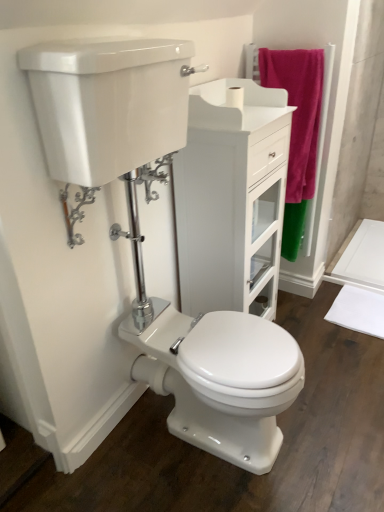
Describe the element at coordinates (297, 130) in the screenshot. I see `pink fuzzy towel at upper right` at that location.

Image resolution: width=384 pixels, height=512 pixels. What do you see at coordinates (232, 198) in the screenshot? I see `white glossy cabinet at center` at bounding box center [232, 198].

What do you see at coordinates (76, 211) in the screenshot? The height and width of the screenshot is (512, 384). I see `chrome metallic lever at upper left, acting as the first plumbing fixture starting from the bottom` at bounding box center [76, 211].

At what (x,y) coordinates should I click in order to perform the action: click on chrome metallic lever at upper left, the second plumbing fixture when ordered from top to bottom. Please return your answer as a coordinate pair (x, y). This screenshot has width=384, height=512. Looking at the image, I should click on (76, 211).

I want to click on polished chrome flush handle at center, which appears as the 2th plumbing fixture when viewed from the left, so click(154, 176).

Does pink fuzzy towel at upper right have a greater height compared to white matte toilet paper at upper center?

Yes.

From the image's perspective, is pink fuzzy towel at upper right over white matte toilet paper at upper center?

No, from the image's perspective, pink fuzzy towel at upper right is not above white matte toilet paper at upper center.

Considering the points (312, 146) and (234, 98), which point is in front, point (312, 146) or point (234, 98)?

Positioned in front is point (234, 98).

How different are the orientations of pink fuzzy towel at upper right and white matte toilet paper at upper center in degrees?

pink fuzzy towel at upper right and white matte toilet paper at upper center are facing 90.5 degrees away from each other.

Does pink fuzzy towel at upper right have a lesser height compared to white glossy cabinet at center?

Correct, pink fuzzy towel at upper right is not as tall as white glossy cabinet at center.

Is white glossy cabinet at center at the back of pink fuzzy towel at upper right?

That's right, pink fuzzy towel at upper right is facing away from white glossy cabinet at center.

Who is smaller, pink fuzzy towel at upper right or white glossy cabinet at center?

pink fuzzy towel at upper right.

Is chrome metallic lever at upper left, the second plumbing fixture from the right, not close to white glossy cabinet at center?

That's not correct — chrome metallic lever at upper left, the second plumbing fixture from the right, is a little close to white glossy cabinet at center.

Does chrome metallic lever at upper left, the second plumbing fixture from the right, have a larger size compared to white glossy cabinet at center?

Actually, chrome metallic lever at upper left, the second plumbing fixture from the right, might be smaller than white glossy cabinet at center.

Which object is wider, chrome metallic lever at upper left, the second plumbing fixture from the right, or white glossy cabinet at center?

white glossy cabinet at center.

From the image's perspective, which one is positioned higher, chrome metallic lever at upper left, acting as the first plumbing fixture starting from the bottom, or white glossy cabinet at center?

From the image's view, white glossy cabinet at center is above.

Could you measure the distance between white matte toilet paper at upper center and polished chrome flush handle at center, marked as the 1th plumbing fixture in a back-to-front arrangement?

white matte toilet paper at upper center is 18.10 inches from polished chrome flush handle at center, marked as the 1th plumbing fixture in a back-to-front arrangement.

Locate an element on the screen. toilet paper above the polished chrome flush handle at center, which is the second plumbing fixture from bottom to top (from the image's perspective) is located at coordinates (235, 97).

Is there a large distance between white matte toilet paper at upper center and polished chrome flush handle at center, marked as the 1th plumbing fixture in a back-to-front arrangement?

No, white matte toilet paper at upper center is not far away from polished chrome flush handle at center, marked as the 1th plumbing fixture in a back-to-front arrangement.

Which of these two, polished chrome flush handle at center, placed as the first plumbing fixture when sorted from right to left, or pink fuzzy towel at upper right, is thinner?

pink fuzzy towel at upper right.

From the image's perspective, which one is positioned lower, polished chrome flush handle at center, marked as the 1th plumbing fixture in a back-to-front arrangement, or pink fuzzy towel at upper right?

From the image's view, polished chrome flush handle at center, marked as the 1th plumbing fixture in a back-to-front arrangement, is below.

Based on the photo, considering the relative positions of polished chrome flush handle at center, which appears as the 2th plumbing fixture when viewed from the left, and pink fuzzy towel at upper right in the image provided, is polished chrome flush handle at center, which appears as the 2th plumbing fixture when viewed from the left, behind pink fuzzy towel at upper right?

No, polished chrome flush handle at center, which appears as the 2th plumbing fixture when viewed from the left, is in front of pink fuzzy towel at upper right.

Is white matte toilet paper at upper center oriented away from pink fuzzy towel at upper right?

white matte toilet paper at upper center does not have its back to pink fuzzy towel at upper right.

Considering the relative positions of white matte toilet paper at upper center and pink fuzzy towel at upper right in the image provided, is white matte toilet paper at upper center in front of pink fuzzy towel at upper right?

Yes, white matte toilet paper at upper center is in front of pink fuzzy towel at upper right.

From the image's perspective, which one is positioned higher, white matte toilet paper at upper center or pink fuzzy towel at upper right?

white matte toilet paper at upper center is shown above in the image.

From a real-world perspective, who is located higher, white matte toilet paper at upper center or pink fuzzy towel at upper right?

white matte toilet paper at upper center.

Between point (296, 217) and point (66, 191), which one is positioned behind?

The point (296, 217) is behind.

Does pink fuzzy towel at upper right have a larger size compared to chrome metallic lever at upper left, the second plumbing fixture when ordered from top to bottom?

Indeed, pink fuzzy towel at upper right has a larger size compared to chrome metallic lever at upper left, the second plumbing fixture when ordered from top to bottom.

From the image's perspective, which object appears higher, pink fuzzy towel at upper right or chrome metallic lever at upper left, which is counted as the 2th plumbing fixture, starting from the back?

pink fuzzy towel at upper right.

Between pink fuzzy towel at upper right and chrome metallic lever at upper left, acting as the first plumbing fixture starting from the bottom, which one appears on the right side from the viewer's perspective?

Positioned to the right is pink fuzzy towel at upper right.

Where is `toilet paper to the left of pink fuzzy towel at upper right`? The image size is (384, 512). toilet paper to the left of pink fuzzy towel at upper right is located at coordinates (x=235, y=97).

Find the location of `bath towel lying on the right of white glossy cabinet at center`. bath towel lying on the right of white glossy cabinet at center is located at coordinates (297, 130).

From the image, which object appears to be farther from pink fuzzy towel at upper right, chrome metallic lever at upper left, the 1th plumbing fixture viewed from the left, or white matte toilet paper at upper center?

chrome metallic lever at upper left, the 1th plumbing fixture viewed from the left, is positioned further to the anchor pink fuzzy towel at upper right.

From the image, which object appears to be farther from chrome metallic lever at upper left, which is counted as the 2th plumbing fixture, starting from the back, polished chrome flush handle at center, marked as the first plumbing fixture in a top-to-bottom arrangement, or white glossy cabinet at center?

Based on the image, white glossy cabinet at center appears to be further to chrome metallic lever at upper left, which is counted as the 2th plumbing fixture, starting from the back.

Looking at the image, which one is located further to white glossy cabinet at center, white matte toilet paper at upper center or chrome metallic lever at upper left, which is counted as the 2th plumbing fixture, starting from the back?

Based on the image, chrome metallic lever at upper left, which is counted as the 2th plumbing fixture, starting from the back, appears to be further to white glossy cabinet at center.

From the image, which object appears to be farther from white glossy cabinet at center, polished chrome flush handle at center, which is the second plumbing fixture in front-to-back order, or chrome metallic lever at upper left, the second plumbing fixture when ordered from top to bottom?

chrome metallic lever at upper left, the second plumbing fixture when ordered from top to bottom.

When comparing their distances from white glossy cabinet at center, does white matte toilet paper at upper center or polished chrome flush handle at center, marked as the first plumbing fixture in a top-to-bottom arrangement, seem closer?

polished chrome flush handle at center, marked as the first plumbing fixture in a top-to-bottom arrangement, lies closer to white glossy cabinet at center than the other object.

From the image, which object appears to be farther from white matte toilet paper at upper center, chrome metallic lever at upper left, the first plumbing fixture in the front-to-back sequence, or polished chrome flush handle at center, placed as the first plumbing fixture when sorted from right to left?

chrome metallic lever at upper left, the first plumbing fixture in the front-to-back sequence, is further to white matte toilet paper at upper center.

From the image, which object appears to be nearer to chrome metallic lever at upper left, acting as the first plumbing fixture starting from the bottom, pink fuzzy towel at upper right or white matte toilet paper at upper center?

Based on the image, white matte toilet paper at upper center appears to be nearer to chrome metallic lever at upper left, acting as the first plumbing fixture starting from the bottom.

From the image, which object appears to be farther from white glossy cabinet at center, pink fuzzy towel at upper right or white matte toilet paper at upper center?

white matte toilet paper at upper center lies further to white glossy cabinet at center than the other object.

The height and width of the screenshot is (512, 384). In order to click on plumbing fixture between white matte toilet paper at upper center and white glossy cabinet at center in the vertical direction in this screenshot , I will do `click(154, 176)`.

You are a GUI agent. You are given a task and a screenshot of the screen. Output one action in this format:
    pyautogui.click(x=<x>, y=<y>)
    Task: Click on the plumbing fixture between chrome metallic lever at upper left, which is counted as the 2th plumbing fixture, starting from the back, and white matte toilet paper at upper center from left to right
    
    Given the screenshot: What is the action you would take?
    pyautogui.click(x=154, y=176)

Locate an element on the screen. The width and height of the screenshot is (384, 512). bathroom cabinet situated between chrome metallic lever at upper left, the second plumbing fixture from the right, and pink fuzzy towel at upper right from left to right is located at coordinates pos(232,198).

Locate an element on the screen. bath towel between white matte toilet paper at upper center and white glossy cabinet at center from top to bottom is located at coordinates (297, 130).